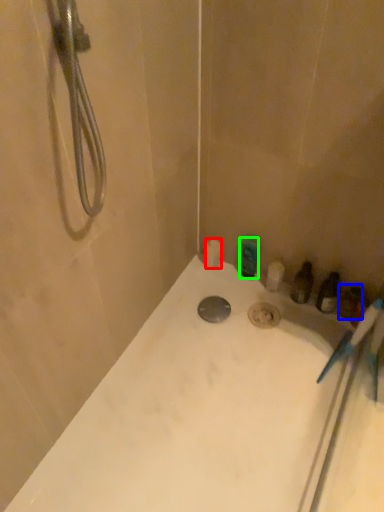
Question: Based on their relative distances, which object is farther from toilet paper (highlighted by a red box)? Choose from toiletry (highlighted by a blue box) and toiletry (highlighted by a green box).

Choices:
 (A) toiletry
 (B) toiletry

Answer: (A)